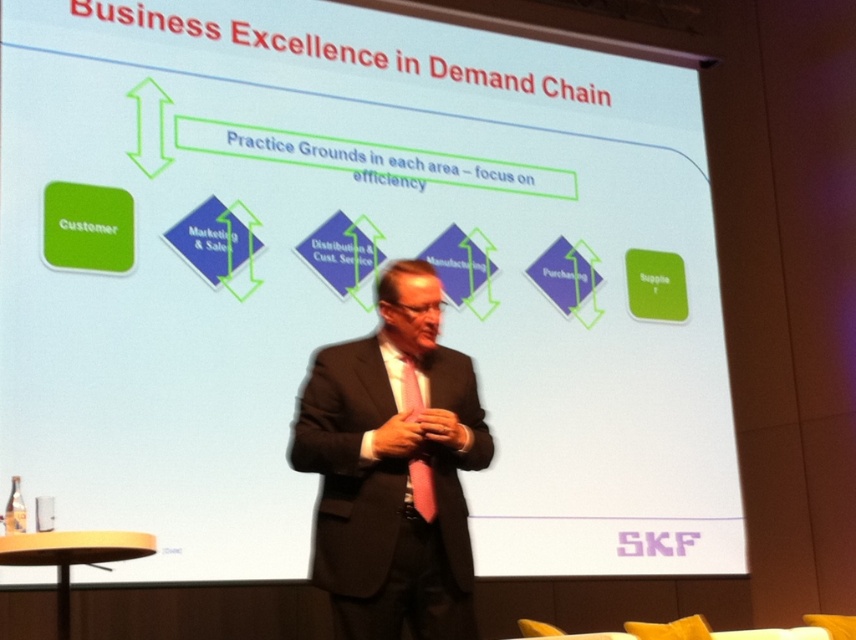
Does matte black suit at center have a smaller size compared to pink satin tie at center?

Actually, matte black suit at center might be larger than pink satin tie at center.

Does matte black suit at center appear on the left side of pink satin tie at center?

Yes, matte black suit at center is to the left of pink satin tie at center.

Which is in front, point (373, 500) or point (415, 484)?

Point (373, 500) is more forward.

Locate an element on the screen. matte black suit at center is located at coordinates (393, 467).